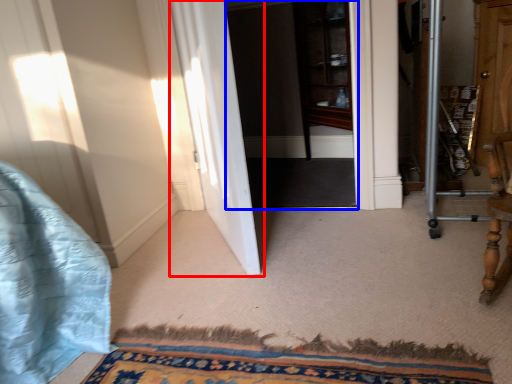
Question: Which of the following is the closest to the observer, door (highlighted by a red box) or screen door (highlighted by a blue box)?

Choices:
 (A) door
 (B) screen door

Answer: (A)